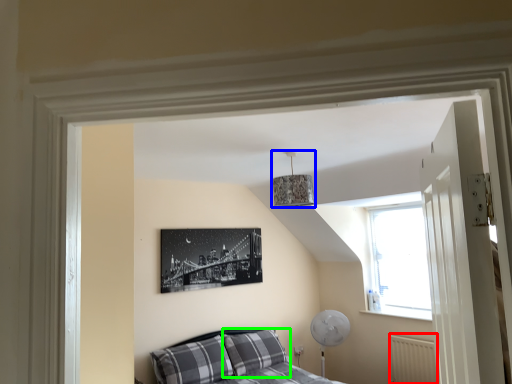
Question: Which is farther away from radiator (highlighted by a red box)? lamp (highlighted by a blue box) or pillow (highlighted by a green box)?

Choices:
 (A) lamp
 (B) pillow

Answer: (A)